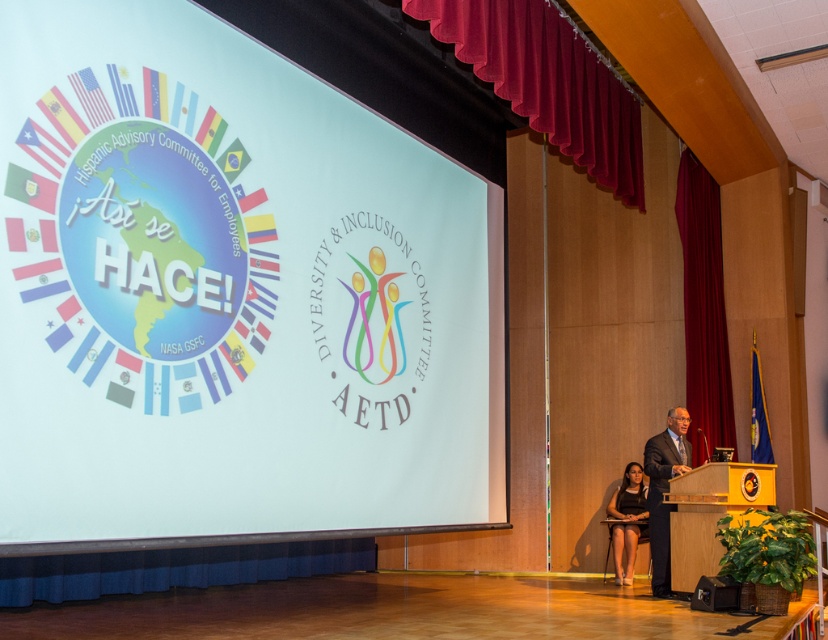
Measure the distance between blue pleated fabric at lower center and camera.

A distance of 5.66 meters exists between blue pleated fabric at lower center and camera.

Based on the photo, is blue pleated fabric at lower center to the left of maroon velvet curtain at right from the viewer's perspective?

Yes, blue pleated fabric at lower center is to the left of maroon velvet curtain at right.

Locate an element on the screen. blue pleated fabric at lower center is located at coordinates (174, 568).

Between white paper at center and maroon velvet curtain at right, which one appears on the left side from the viewer's perspective?

From the viewer's perspective, white paper at center appears more on the left side.

Is white paper at center closer to camera compared to maroon velvet curtain at right?

Yes.

Locate an element on the screen. The image size is (828, 640). white paper at center is located at coordinates point(230,296).

Is blue pleated fabric at lower center below wooden podium at center?

Correct, blue pleated fabric at lower center is located below wooden podium at center.

Describe the element at coordinates (174, 568) in the screenshot. The width and height of the screenshot is (828, 640). I see `blue pleated fabric at lower center` at that location.

Which is behind, point (35, 573) or point (679, 497)?

The point (679, 497) is more distant.

Locate an element on the screen. This screenshot has height=640, width=828. blue pleated fabric at lower center is located at coordinates (174, 568).